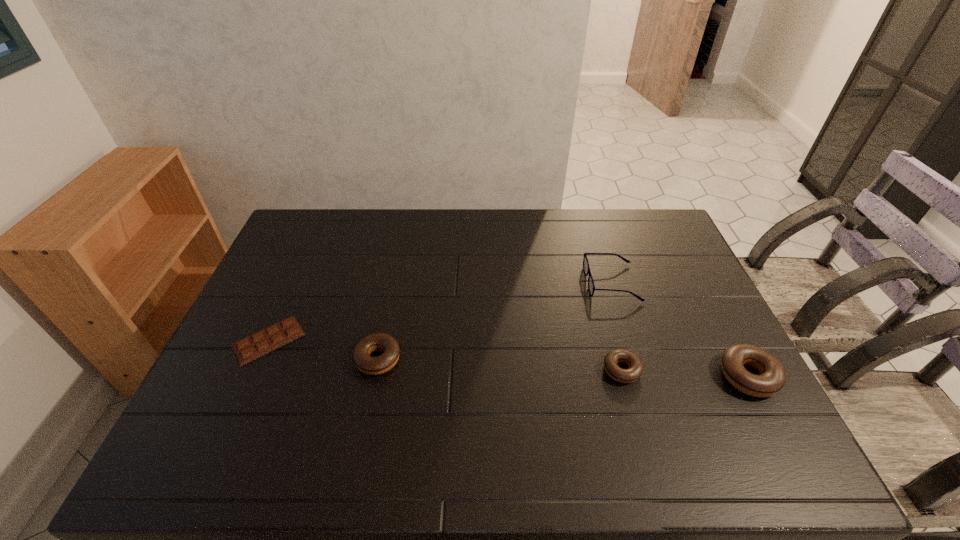
The width and height of the screenshot is (960, 540). I want to click on the leftmost doughnut, so click(x=364, y=362).

Locate an element on the screen. The height and width of the screenshot is (540, 960). the third tallest object is located at coordinates (364, 362).

Identify the location of the fourth tallest object. (635, 369).

The image size is (960, 540). Find the location of `the second doughnut from left to right`. the second doughnut from left to right is located at coordinates (635, 369).

Locate an element on the screen. the rightmost object is located at coordinates (772, 378).

Locate an element on the screen. The width and height of the screenshot is (960, 540). the rightmost doughnut is located at coordinates (772, 378).

You are a GUI agent. You are given a task and a screenshot of the screen. Output one action in this format:
    pyautogui.click(x=<x>, y=<y>)
    Task: Click on the leftmost object
    
    Given the screenshot: What is the action you would take?
    pyautogui.click(x=277, y=335)

You are a GUI agent. You are given a task and a screenshot of the screen. Output one action in this format:
    pyautogui.click(x=<x>, y=<y>)
    Task: Click on the chocolate bar
    This screenshot has height=540, width=960.
    Given the screenshot: What is the action you would take?
    pyautogui.click(x=277, y=335)

I want to click on spectacles, so click(591, 287).

Find the location of a particular element. Image resolution: width=960 pixels, height=540 pixels. vacant area located on the back of the leftmost doughnut is located at coordinates (396, 275).